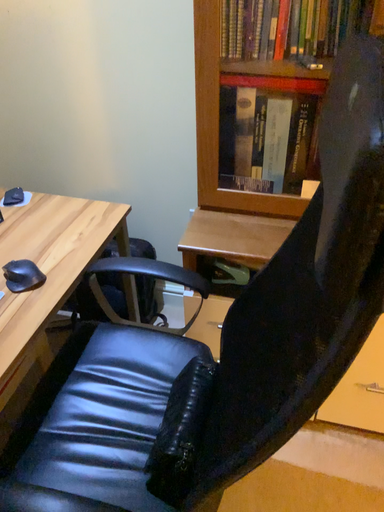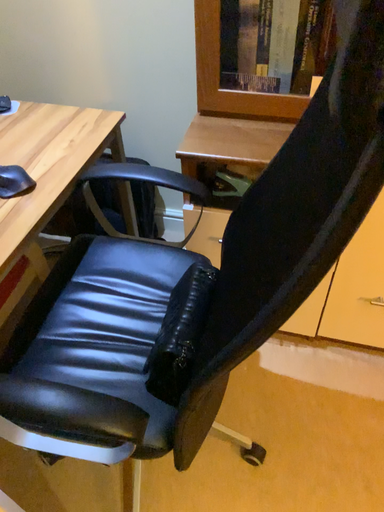
Question: How did the camera likely rotate when shooting the video?

Choices:
 (A) rotated downward
 (B) rotated upward

Answer: (A)